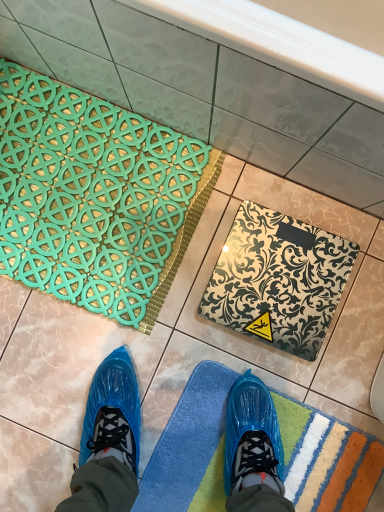
This screenshot has height=512, width=384. I want to click on free spot above blue textured bath mat at lower center, positioned as the 3th bath mat in top-to-bottom order (from a real-world perspective), so click(279, 458).